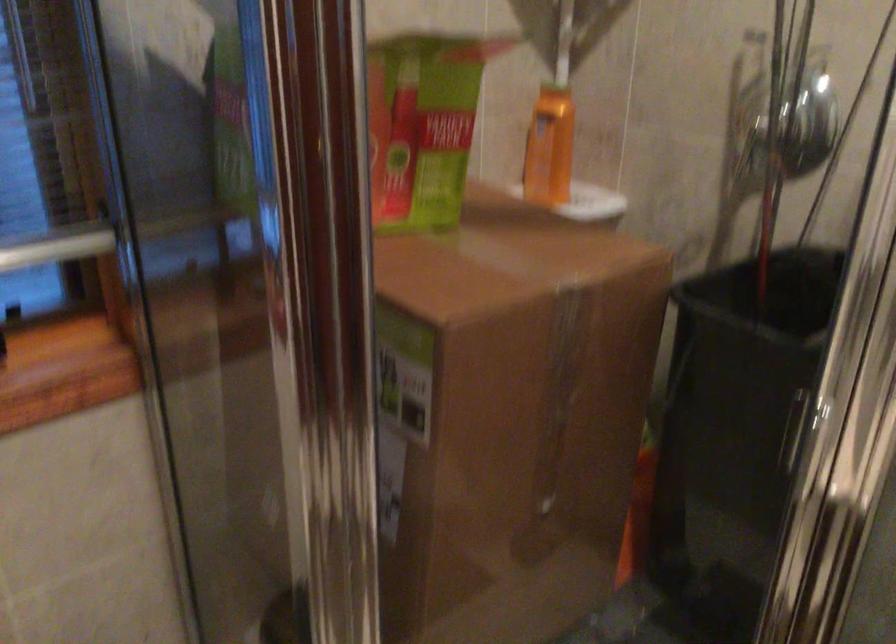
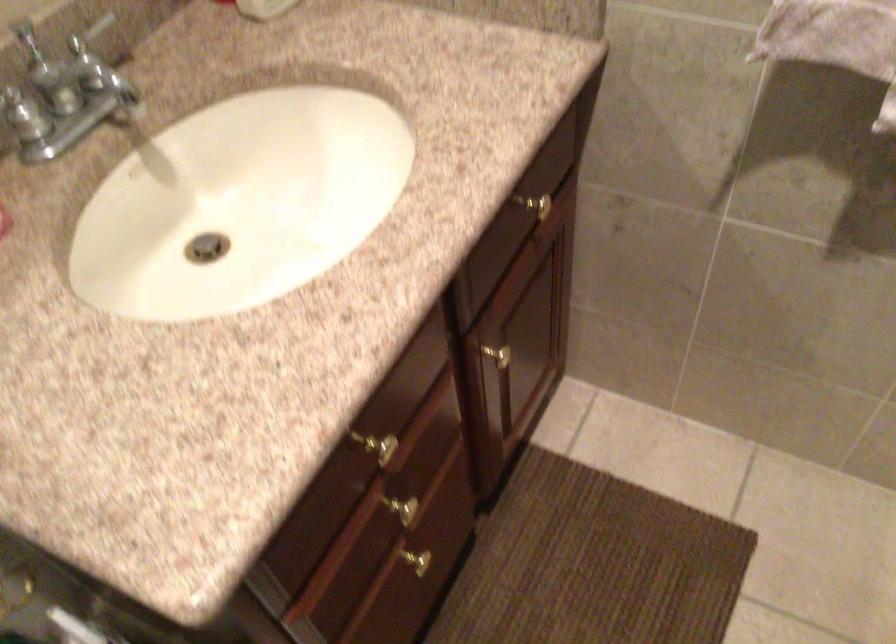
The first image is from the beginning of the video and the second image is from the end. How did the camera likely rotate when shooting the video?

The camera rotated toward right-down.